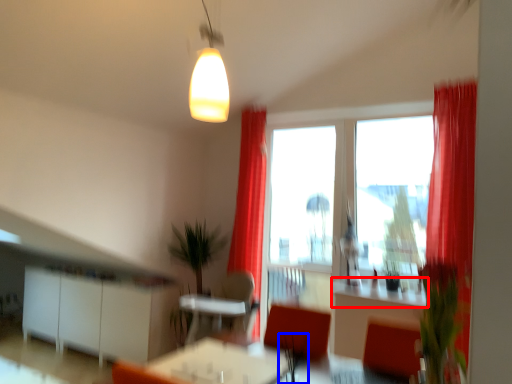
Question: Which of the following is the closest to the observer, counter top (highlighted by a red box) or plant (highlighted by a blue box)?

Choices:
 (A) counter top
 (B) plant

Answer: (B)